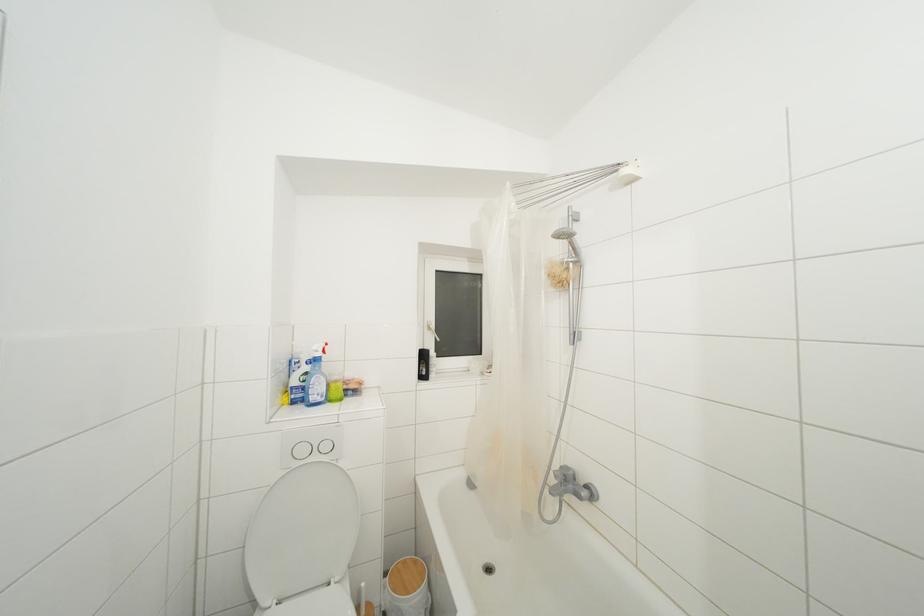
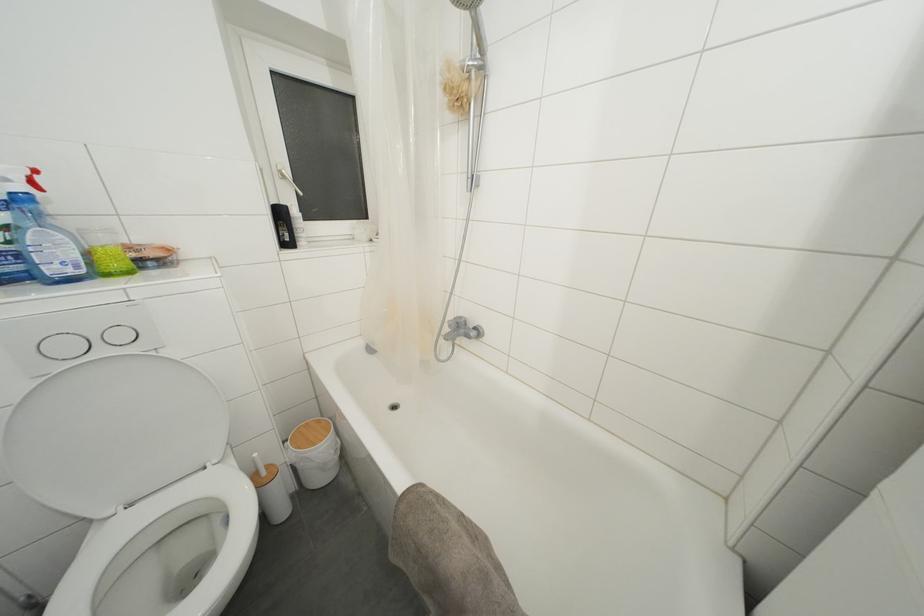
In the second image, find the point that corresponds to (408,567) in the first image.

(310, 429)